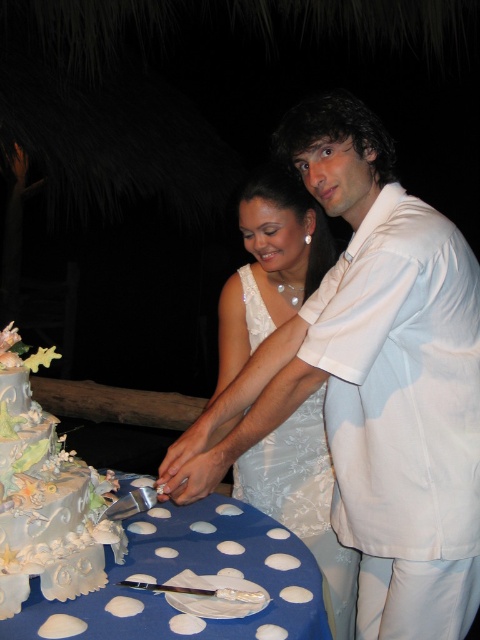
Question: Is the position of white satin dress at center less distant than that of blue polka dot tablecloth at lower center?

Choices:
 (A) no
 (B) yes

Answer: (A)

Question: Is blue polka dot tablecloth at lower center closer to camera compared to pastel silver cake at lower left?

Choices:
 (A) no
 (B) yes

Answer: (B)

Question: Which object is farther from the camera taking this photo?

Choices:
 (A) pastel silver cake at lower left
 (B) blue polka dot tablecloth at lower center
 (C) white satin dress at center
 (D) white satin wedding dress at center

Answer: (D)

Question: Which of the following is the farthest from the observer?

Choices:
 (A) pastel silver cake at lower left
 (B) blue polka dot tablecloth at lower center

Answer: (A)

Question: Can you confirm if white satin dress at center is positioned below white satin wedding dress at center?

Choices:
 (A) no
 (B) yes

Answer: (B)

Question: Which object appears farthest from the camera in this image?

Choices:
 (A) white satin wedding dress at center
 (B) pastel silver cake at lower left
 (C) white satin dress at center

Answer: (A)